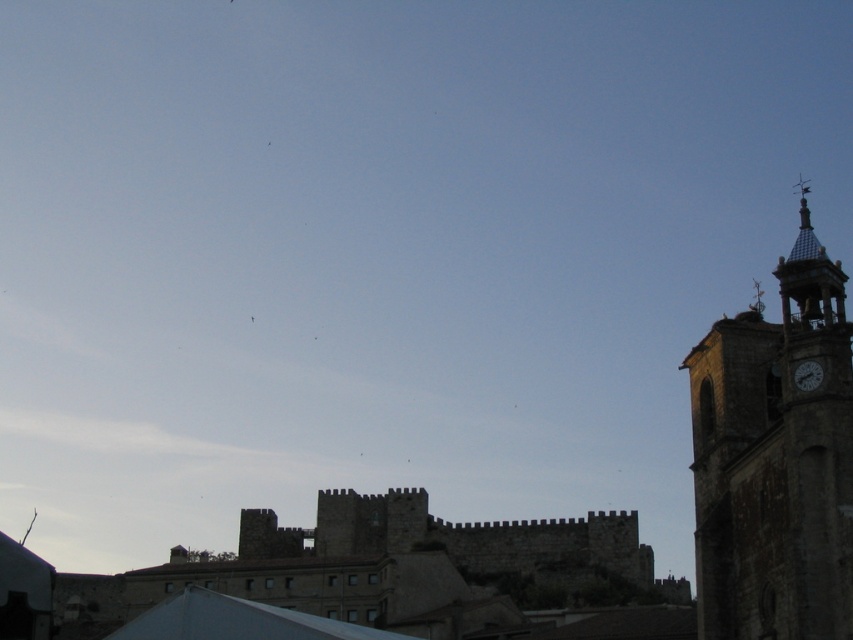
Question: Which point is farther from the camera taking this photo?

Choices:
 (A) (316, 621)
 (B) (782, 624)
 (C) (817, 364)

Answer: (A)

Question: Is white fabric canopy at lower center in front of matte gray clock at right?

Choices:
 (A) no
 (B) yes

Answer: (A)

Question: Can you confirm if dark stone clock tower at right is bigger than white fabric canopy at lower center?

Choices:
 (A) no
 (B) yes

Answer: (A)

Question: Which point is farther from the camera taking this photo?

Choices:
 (A) (805, 358)
 (B) (146, 620)

Answer: (B)

Question: Which point is closer to the camera taking this photo?

Choices:
 (A) (219, 605)
 (B) (722, 470)

Answer: (A)

Question: Can you confirm if white fabric canopy at lower center is positioned to the right of matte gray clock at right?

Choices:
 (A) yes
 (B) no

Answer: (B)